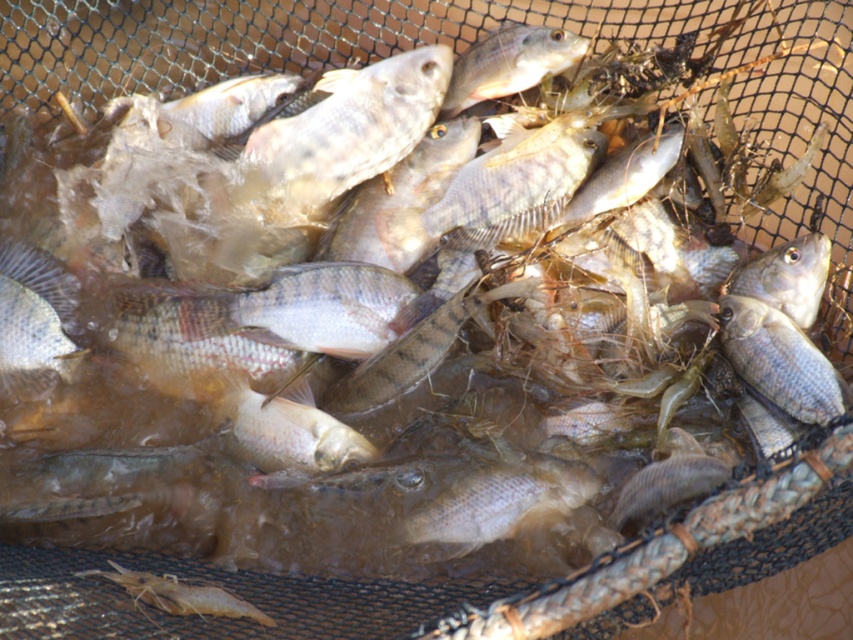
Question: Can you confirm if slightly translucent silver fish at center is wider than satin silver fish at center?

Choices:
 (A) no
 (B) yes

Answer: (B)

Question: Is satin silver fish at center positioned in front of shiny silver fish at upper center?

Choices:
 (A) no
 (B) yes

Answer: (B)

Question: Estimate the real-world distances between objects in this image. Which object is farther from the satin silver fish at center?

Choices:
 (A) slightly translucent silver fish at center
 (B) shiny silver fish at center
 (C) shiny silver fish at upper center

Answer: (B)

Question: Can you confirm if shiny silver fish at center is bigger than shiny silver fish at upper center?

Choices:
 (A) yes
 (B) no

Answer: (A)

Question: Which object is positioned closest to the shiny silver fish at center?

Choices:
 (A) slightly translucent silver fish at center
 (B) shiny silver fish at upper center

Answer: (A)

Question: Among these points, which one is nearest to the camera?

Choices:
 (A) (6, 394)
 (B) (751, 349)
 (C) (538, 515)

Answer: (C)